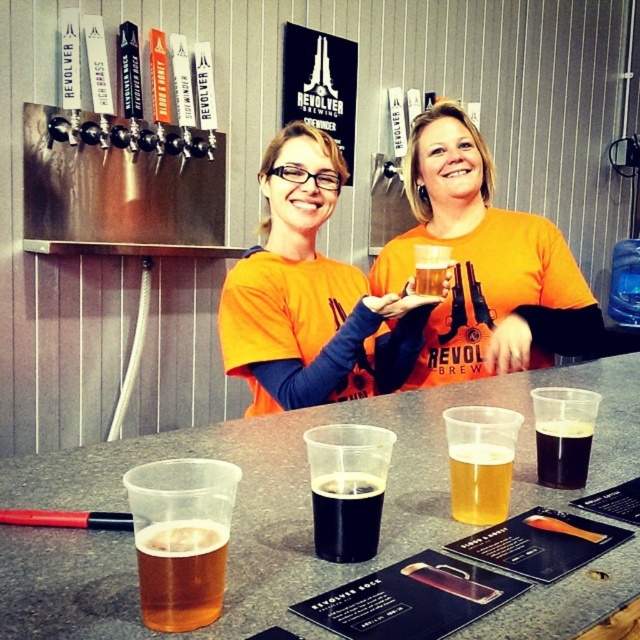
Does orange cotton shirt at center have a smaller size compared to orange t-shirt at center?

Actually, orange cotton shirt at center might be larger than orange t-shirt at center.

You are a GUI agent. You are given a task and a screenshot of the screen. Output one action in this format:
    pyautogui.click(x=<x>, y=<y>)
    Task: Click on the orange cotton shirt at center
    The width and height of the screenshot is (640, 640).
    Given the screenshot: What is the action you would take?
    pyautogui.click(x=483, y=262)

Is point (352, 493) closer to camera compared to point (500, 515)?

That is True.

Does black matte glass at center have a greater width compared to golden amber liquid at center?

Incorrect, black matte glass at center's width does not surpass golden amber liquid at center's.

Is point (362, 499) farther from viewer compared to point (454, 458)?

No.

This screenshot has height=640, width=640. I want to click on black matte glass at center, so click(346, 515).

Between point (424, 163) and point (554, 486), which one is positioned in front?

Point (554, 486)

The width and height of the screenshot is (640, 640). What do you see at coordinates (483, 262) in the screenshot? I see `orange cotton shirt at center` at bounding box center [483, 262].

Describe the element at coordinates (483, 262) in the screenshot. The height and width of the screenshot is (640, 640). I see `orange cotton shirt at center` at that location.

Image resolution: width=640 pixels, height=640 pixels. What are the coordinates of `orange cotton shirt at center` in the screenshot? It's located at (483, 262).